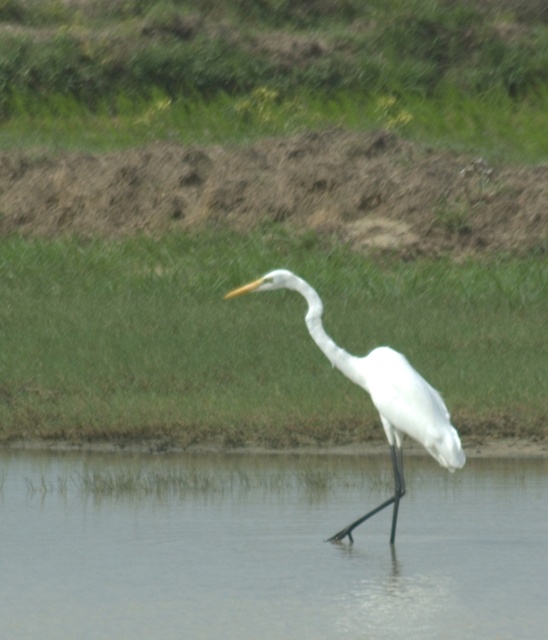
Between clear water at center and white matte bird at center, which one is positioned lower?

clear water at center

Does point (145, 481) come in front of point (461, 456)?

No.

Is point (246, 472) farther from camera compared to point (332, 346)?

Yes, point (246, 472) is farther from viewer.

This screenshot has width=548, height=640. What are the coordinates of `clear water at center` in the screenshot? It's located at (269, 547).

Is white matte bird at center shorter than white matte neck at center?

Incorrect, white matte bird at center's height does not fall short of white matte neck at center's.

Does white matte bird at center appear on the right side of white matte neck at center?

Yes, white matte bird at center is to the right of white matte neck at center.

Between point (393, 426) and point (327, 355), which one is positioned behind?

The point (393, 426) is behind.

You are a GUI agent. You are given a task and a screenshot of the screen. Output one action in this format:
    pyautogui.click(x=<x>, y=<y>)
    Task: Click on the white matte bird at center
    The height and width of the screenshot is (640, 548).
    Given the screenshot: What is the action you would take?
    pyautogui.click(x=379, y=394)

Is clear water at center below white matte neck at center?

Yes.

Who is more forward, (62, 632) or (281, 280)?

Point (62, 632)

Does point (311, 548) come behind point (306, 291)?

Yes, it is.

You are a GUI agent. You are given a task and a screenshot of the screen. Output one action in this format:
    pyautogui.click(x=<x>, y=<y>)
    Task: Click on the clear water at center
    This screenshot has width=548, height=640.
    Given the screenshot: What is the action you would take?
    pyautogui.click(x=269, y=547)